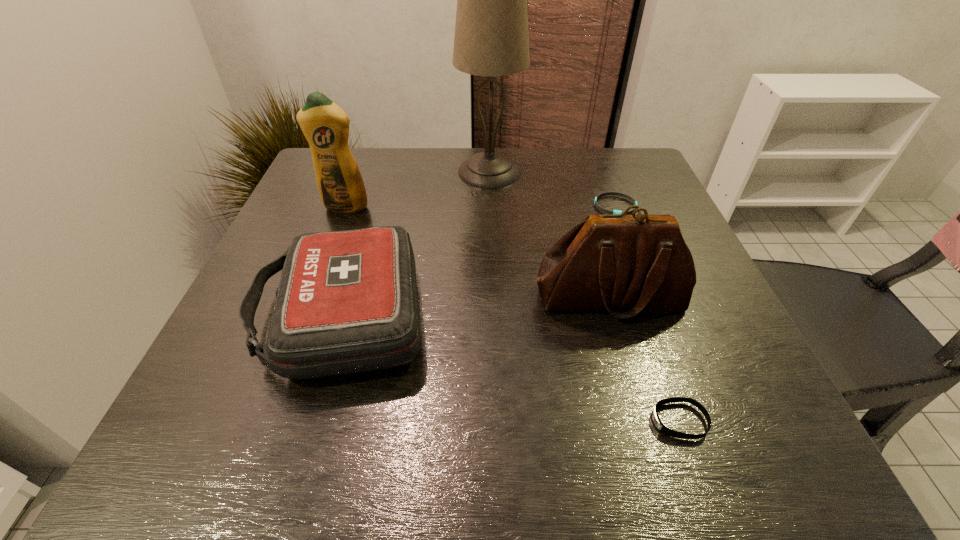
Where is `wristband that is at the far edge`? wristband that is at the far edge is located at coordinates (626, 196).

The image size is (960, 540). I want to click on object present at the near edge, so click(662, 428).

In order to click on detergent at the left edge in this screenshot , I will do `click(325, 125)`.

Locate an element on the screen. the first-aid kit that is at the left edge is located at coordinates (347, 302).

Locate an element on the screen. This screenshot has height=540, width=960. shoulder bag positioned at the right edge is located at coordinates (635, 263).

Identify the location of object that is positioned at the far right corner. The image size is (960, 540). (626, 196).

You are a GUI agent. You are given a task and a screenshot of the screen. Output one action in this format:
    pyautogui.click(x=<x>, y=<y>)
    Task: Click on the object that is positioned at the near right corner
    
    Given the screenshot: What is the action you would take?
    pyautogui.click(x=662, y=428)

Locate an element on the screen. The height and width of the screenshot is (540, 960). vacant area at the far edge of the desktop is located at coordinates (543, 156).

In the image, there is a desktop. At what (x,y) coordinates should I click in order to perform the action: click on vacant space at the near edge. Please return your answer as a coordinate pair (x, y). This screenshot has width=960, height=540. Looking at the image, I should click on (503, 419).

The width and height of the screenshot is (960, 540). Identify the location of vacant space at the left edge. (273, 288).